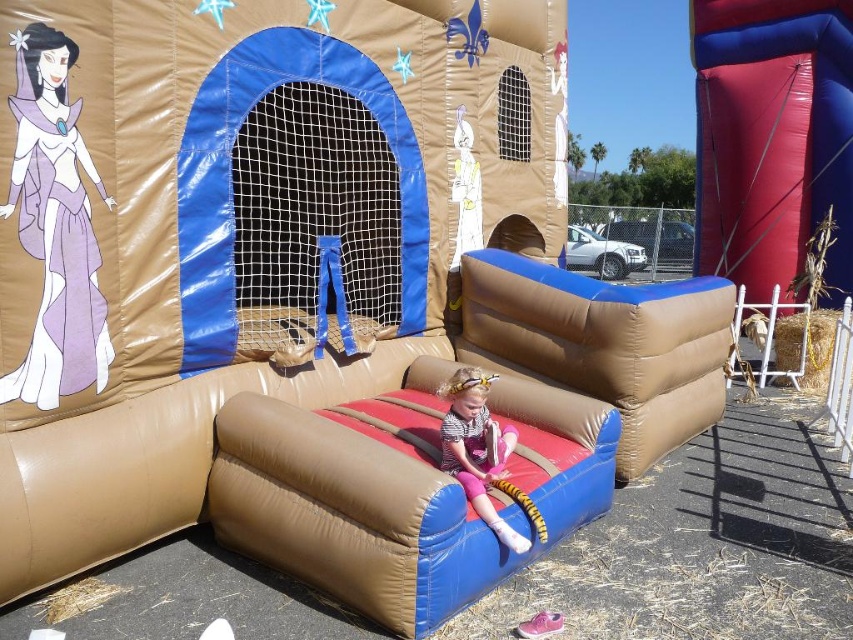
You are a parent supervising children at a party. You see the smooth red slide at right and the purple satin dress at upper left. Which object is located to the right of the other?

The smooth red slide at right is positioned on the right side of purple satin dress at upper left.

You are planning to set up a small picnic blanket between the smooth red slide at right and the matte pink leggings at center. Considering their widths, which object should you place the blanket closer to to ensure it fits comfortably?

The smooth red slide at right is wider than the matte pink leggings at center. To ensure the picnic blanket fits comfortably, place it closer to the matte pink leggings at center since it has a narrower width.

You are a parent supervising children at a playground. You see a child wearing matte pink leggings at center and a smooth red slide at right. If you want to ensure the child can reach the slide safely, what is the minimum distance you should maintain between them?

The minimum distance you should maintain between the child wearing matte pink leggings at center and the smooth red slide at right is 8.11 meters to ensure safe access.